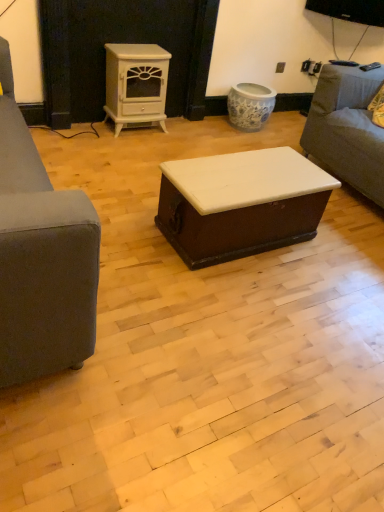
What do you see at coordinates (136, 84) in the screenshot? This screenshot has height=512, width=384. I see `white glossy wood stove at upper center` at bounding box center [136, 84].

Image resolution: width=384 pixels, height=512 pixels. Describe the element at coordinates (347, 128) in the screenshot. I see `gray fabric couch at right` at that location.

Image resolution: width=384 pixels, height=512 pixels. In order to click on white glossy wood stove at upper center in this screenshot , I will do `click(136, 84)`.

From the image's perspective, which one is positioned higher, white glossy trunk at center or white glossy wood stove at upper center?

white glossy wood stove at upper center.

Which is more to the left, white glossy trunk at center or white glossy wood stove at upper center?

From the viewer's perspective, white glossy wood stove at upper center appears more on the left side.

Which is further, (254, 162) or (161, 127)?

The point (161, 127) is behind.

Is white glossy trunk at center with white glossy wood stove at upper center?

No, white glossy trunk at center is not beside white glossy wood stove at upper center.

From a real-world perspective, is white glossy wood stove at upper center positioned over white glossy trunk at center based on gravity?

Yes.

Between white glossy wood stove at upper center and white glossy trunk at center, which one appears on the left side from the viewer's perspective?

Positioned to the left is white glossy wood stove at upper center.

Based on the photo, considering the sizes of objects white glossy wood stove at upper center and white glossy trunk at center in the image provided, who is bigger, white glossy wood stove at upper center or white glossy trunk at center?

white glossy trunk at center is bigger.

Considering the sizes of white glossy wood stove at upper center and white glossy trunk at center in the image, is white glossy wood stove at upper center taller or shorter than white glossy trunk at center?

In the image, white glossy wood stove at upper center appears to be taller than white glossy trunk at center.

Considering the positions of points (130, 114) and (329, 114), is point (130, 114) farther from camera compared to point (329, 114)?

Yes, point (130, 114) is farther from viewer.

Which object is positioned more to the left, white glossy wood stove at upper center or gray fabric couch at right?

white glossy wood stove at upper center is more to the left.

Does white glossy wood stove at upper center have a lesser width compared to gray fabric couch at right?

Yes.

Is white glossy wood stove at upper center in front of or behind gray fabric couch at right in the image?

white glossy wood stove at upper center is behind gray fabric couch at right.

From a real-world perspective, between gray fabric couch at right and white glossy trunk at center, who is vertically higher?

gray fabric couch at right is physically above.

Looking at this image, is the depth of gray fabric couch at right less than that of white glossy trunk at center?

No.

Which of these two, gray fabric couch at right or white glossy trunk at center, stands shorter?

white glossy trunk at center is shorter.

From a real-world perspective, is white glossy trunk at center physically above gray fabric couch at right?

No, from a real-world perspective, white glossy trunk at center is not above gray fabric couch at right.

Does white glossy trunk at center have a greater height compared to gray fabric couch at right?

Incorrect, the height of white glossy trunk at center is not larger of that of gray fabric couch at right.

Would you consider gray fabric couch at right to be distant from white glossy wood stove at upper center?

That's right, there is a large distance between gray fabric couch at right and white glossy wood stove at upper center.

Between gray fabric couch at right and white glossy wood stove at upper center, which one is positioned in front?

gray fabric couch at right is in front.

In the image, there is a gray fabric couch at right. Where is `appliance below it (from a real-world perspective)`? This screenshot has width=384, height=512. appliance below it (from a real-world perspective) is located at coordinates (136, 84).

Between gray fabric couch at right and white glossy wood stove at upper center, which one appears on the right side from the viewer's perspective?

gray fabric couch at right.

This screenshot has width=384, height=512. Find the location of `appliance that appears above the white glossy trunk at center (from the image's perspective)`. appliance that appears above the white glossy trunk at center (from the image's perspective) is located at coordinates (x=136, y=84).

Locate an element on the screen. Image resolution: width=384 pixels, height=512 pixels. table located in front of the white glossy wood stove at upper center is located at coordinates (240, 203).

From the picture: From the image, which object appears to be nearer to white glossy wood stove at upper center, white glossy trunk at center or gray fabric couch at right?

gray fabric couch at right is positioned closer to the anchor white glossy wood stove at upper center.

Estimate the real-world distances between objects in this image. Which object is closer to gray fabric couch at right, white glossy wood stove at upper center or white glossy trunk at center?

white glossy trunk at center is positioned closer to the anchor gray fabric couch at right.

Based on their spatial positions, is white glossy wood stove at upper center or gray fabric couch at right further from white glossy trunk at center?

white glossy wood stove at upper center is further to white glossy trunk at center.

Which object lies nearer to the anchor point white glossy trunk at center, gray fabric couch at right or white glossy wood stove at upper center?

Among the two, gray fabric couch at right is located nearer to white glossy trunk at center.

Looking at the image, which one is located further to white glossy wood stove at upper center, gray fabric couch at right or white glossy trunk at center?

The object further to white glossy wood stove at upper center is white glossy trunk at center.

From the image, which object appears to be nearer to gray fabric couch at right, white glossy trunk at center or white glossy wood stove at upper center?

white glossy trunk at center is positioned closer to the anchor gray fabric couch at right.

You are a GUI agent. You are given a task and a screenshot of the screen. Output one action in this format:
    pyautogui.click(x=<x>, y=<y>)
    Task: Click on the table between white glossy wood stove at upper center and gray fabric couch at right
    
    Given the screenshot: What is the action you would take?
    pyautogui.click(x=240, y=203)